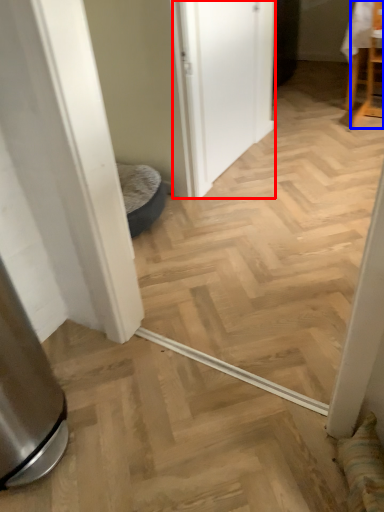
Question: Among these objects, which one is nearest to the camera, screen door (highlighted by a red box) or chair (highlighted by a blue box)?

Choices:
 (A) screen door
 (B) chair

Answer: (A)